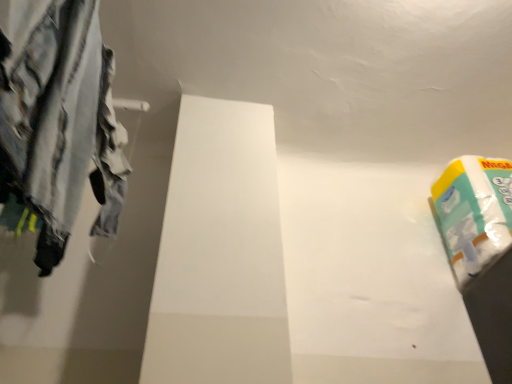
What is the approximate height of white glossy toilet paper at upper right?

white glossy toilet paper at upper right is 37.56 centimeters tall.

What are the coordinates of `white glossy toilet paper at upper right` in the screenshot? It's located at (474, 213).

What do you see at coordinates (474, 213) in the screenshot? The height and width of the screenshot is (384, 512). I see `white glossy toilet paper at upper right` at bounding box center [474, 213].

The width and height of the screenshot is (512, 384). What do you see at coordinates (58, 119) in the screenshot? I see `striped cotton pants at left` at bounding box center [58, 119].

The height and width of the screenshot is (384, 512). I want to click on striped cotton pants at left, so click(x=58, y=119).

Find the location of a particular element. This screenshot has height=384, width=512. white glossy toilet paper at upper right is located at coordinates (474, 213).

Which is more to the right, striped cotton pants at left or white glossy toilet paper at upper right?

white glossy toilet paper at upper right is more to the right.

Which object is closer to the camera, striped cotton pants at left or white glossy toilet paper at upper right?

Positioned in front is striped cotton pants at left.

Does point (65, 131) lie behind point (487, 216)?

No, (65, 131) is closer to viewer.

From the image's perspective, is striped cotton pants at left positioned above or below white glossy toilet paper at upper right?

striped cotton pants at left is situated higher than white glossy toilet paper at upper right in the image.

From a real-world perspective, is striped cotton pants at left positioned above or below white glossy toilet paper at upper right?

From a real-world perspective, striped cotton pants at left is physically below white glossy toilet paper at upper right.

Considering the sizes of objects striped cotton pants at left and white glossy toilet paper at upper right in the image provided, who is thinner, striped cotton pants at left or white glossy toilet paper at upper right?

striped cotton pants at left.

Considering the relative sizes of striped cotton pants at left and white glossy toilet paper at upper right in the image provided, is striped cotton pants at left taller than white glossy toilet paper at upper right?

Correct, striped cotton pants at left is much taller as white glossy toilet paper at upper right.

Between striped cotton pants at left and white glossy toilet paper at upper right, which one has larger size?

With larger size is white glossy toilet paper at upper right.

Looking at this image, is striped cotton pants at left completely or partially outside of white glossy toilet paper at upper right?

Yes, striped cotton pants at left is outside of white glossy toilet paper at upper right.

Are striped cotton pants at left and white glossy toilet paper at upper right located far from each other?

Yes.

Is striped cotton pants at left oriented away from white glossy toilet paper at upper right?

No, striped cotton pants at left is not facing the opposite direction of white glossy toilet paper at upper right.

Can you tell me how much striped cotton pants at left and white glossy toilet paper at upper right differ in facing direction?

The facing directions of striped cotton pants at left and white glossy toilet paper at upper right are 90.5 degrees apart.

In the image, there is a striped cotton pants at left. Identify the location of toilet paper below it (from the image's perspective). pyautogui.click(x=474, y=213).

Can you confirm if white glossy toilet paper at upper right is positioned to the right of striped cotton pants at left?

Yes, white glossy toilet paper at upper right is to the right of striped cotton pants at left.

Is white glossy toilet paper at upper right in front of striped cotton pants at left?

No, white glossy toilet paper at upper right is further to the viewer.

Is point (448, 207) positioned in front of point (58, 74)?

No, it is not.

From the image's perspective, is white glossy toilet paper at upper right positioned above or below striped cotton pants at left?

Based on their image positions, white glossy toilet paper at upper right is located beneath striped cotton pants at left.

From a real-world perspective, which is physically below, white glossy toilet paper at upper right or striped cotton pants at left?

striped cotton pants at left, from a real-world perspective.

Between white glossy toilet paper at upper right and striped cotton pants at left, which one has smaller width?

Thinner between the two is striped cotton pants at left.

Considering the sizes of objects white glossy toilet paper at upper right and striped cotton pants at left in the image provided, who is taller, white glossy toilet paper at upper right or striped cotton pants at left?

Standing taller between the two is striped cotton pants at left.

Between white glossy toilet paper at upper right and striped cotton pants at left, which one has larger size?

white glossy toilet paper at upper right.

Looking at this image, is striped cotton pants at left surrounded by white glossy toilet paper at upper right?

Definitely not — striped cotton pants at left is not inside white glossy toilet paper at upper right.

Would you say white glossy toilet paper at upper right is a long distance from striped cotton pants at left?

Yes, white glossy toilet paper at upper right and striped cotton pants at left are quite far apart.

Is white glossy toilet paper at upper right facing away from striped cotton pants at left?

No, striped cotton pants at left is not at the back of white glossy toilet paper at upper right.

How different are the orientations of white glossy toilet paper at upper right and striped cotton pants at left in degrees?

The angle between the facing direction of white glossy toilet paper at upper right and the facing direction of striped cotton pants at left is 90.5 degrees.

How much distance is there between white glossy toilet paper at upper right and striped cotton pants at left?

A distance of 3.48 feet exists between white glossy toilet paper at upper right and striped cotton pants at left.

The height and width of the screenshot is (384, 512). I want to click on trousers below the white glossy toilet paper at upper right (from a real-world perspective), so click(58, 119).

Where is `toilet paper that appears above the striped cotton pants at left (from a real-world perspective)`? toilet paper that appears above the striped cotton pants at left (from a real-world perspective) is located at coordinates click(x=474, y=213).

I want to click on toilet paper located behind the striped cotton pants at left, so click(x=474, y=213).